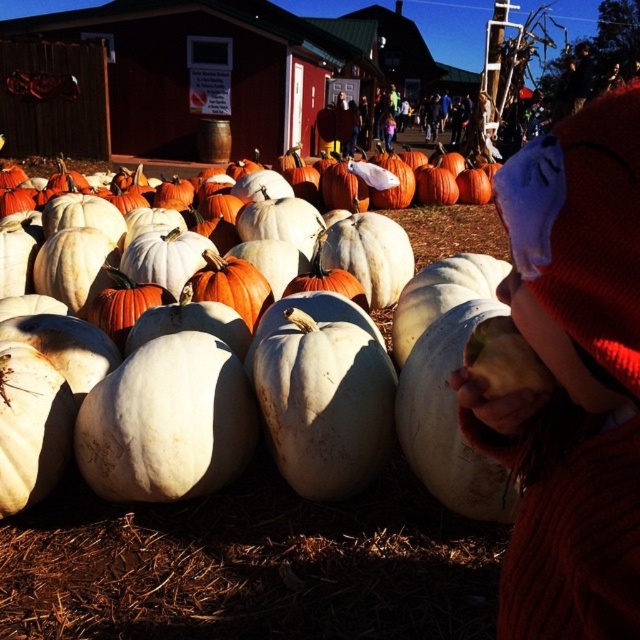
Who is lower down, red knit sweater at right or white matte pumpkin at center?

red knit sweater at right

In the scene shown: Between red knit sweater at right and white matte pumpkin at center, which one is positioned higher?

Positioned higher is white matte pumpkin at center.

What do you see at coordinates (572, 378) in the screenshot? The image size is (640, 640). I see `red knit sweater at right` at bounding box center [572, 378].

Where is `red knit sweater at right`? The width and height of the screenshot is (640, 640). red knit sweater at right is located at coordinates (572, 378).